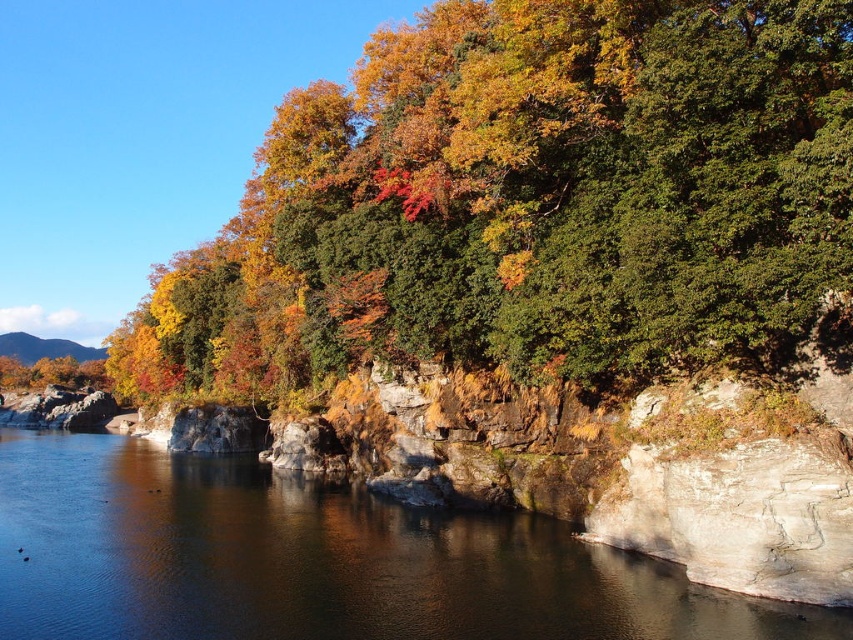
You are an artist sitting by the riverside and want to paint the autumn leaves at upper center and the smooth rock river at center. Which object is located above the other?

The autumn leaves at upper center is positioned over smooth rock river at center.

You are a photographer aiming to capture the autumn leaves at upper center and the smooth rock river at center in your shot. Based on their positions, which object would appear larger in the photo?

The autumn leaves at upper center would appear larger in the photo because they have a greater height compared to the smooth rock river at center.